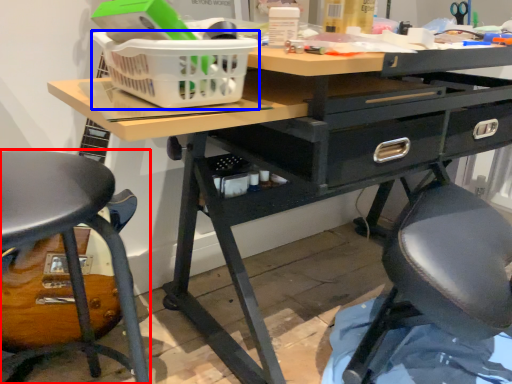
Question: Which point is further to the camera, chair (highlighted by a red box) or basket (highlighted by a blue box)?

Choices:
 (A) chair
 (B) basket

Answer: (B)